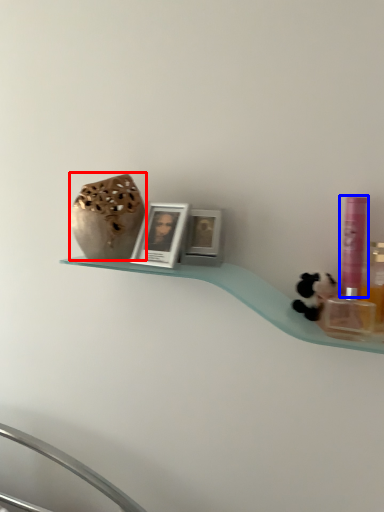
Question: Which point is further to the camera, vase (highlighted by a red box) or mouthwash (highlighted by a blue box)?

Choices:
 (A) vase
 (B) mouthwash

Answer: (A)